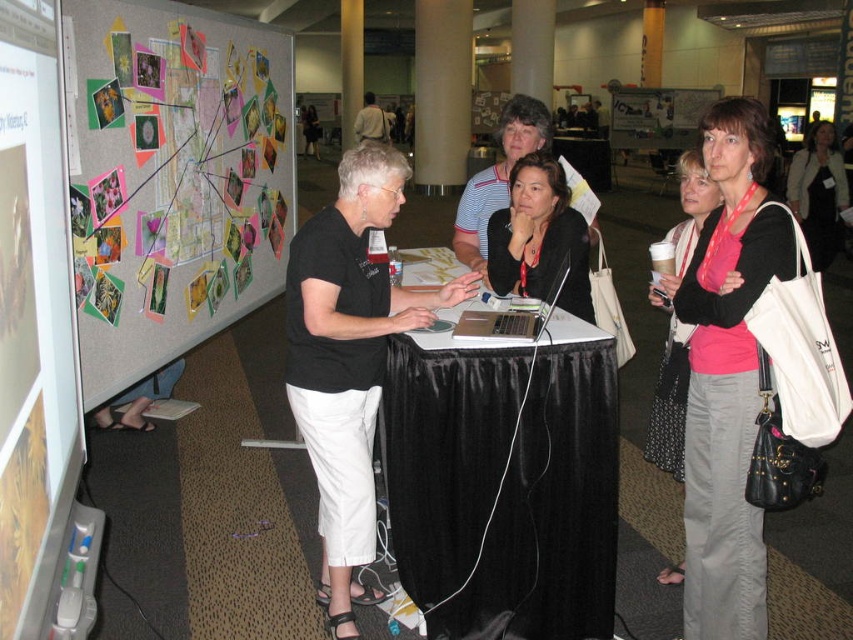
Question: Observing the image, what is the correct spatial positioning of matte black laptop at center in reference to pink fabric purse at center?

Choices:
 (A) right
 (B) left

Answer: (B)

Question: Observing the image, what is the correct spatial positioning of pink fabric purse at center in reference to silver metallic laptop at center?

Choices:
 (A) above
 (B) below

Answer: (A)

Question: Is matte black laptop at center below striped cotton shirt at center?

Choices:
 (A) yes
 (B) no

Answer: (A)

Question: Which point is farther to the camera?

Choices:
 (A) (515, 108)
 (B) (704, 534)
 (C) (372, 108)
 (D) (517, 173)

Answer: (C)

Question: Which object is the closest to the striped cotton shirt at center?

Choices:
 (A) pink fabric shirt at center
 (B) pink fabric scarf at right
 (C) light brown leather jacket at upper center
 (D) silver metallic laptop at center

Answer: (D)

Question: Which point is closer to the camera taking this photo?

Choices:
 (A) (482, 216)
 (B) (561, 273)
 (C) (700, 204)

Answer: (B)